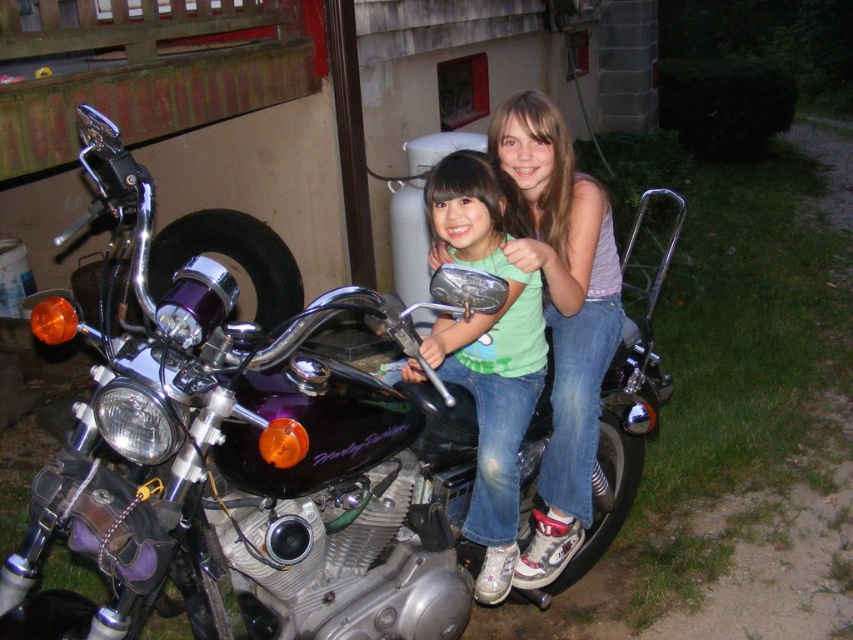
From the picture: Between denim jeans at center and green matte shirt at center, which one is positioned lower?

green matte shirt at center

Between denim jeans at center and green matte shirt at center, which one is positioned higher?

denim jeans at center

Locate an element on the screen. denim jeans at center is located at coordinates (561, 316).

The width and height of the screenshot is (853, 640). Identify the location of denim jeans at center. (561, 316).

Can you confirm if shiny purple motorcycle at center is wider than denim jeans at center?

Correct, the width of shiny purple motorcycle at center exceeds that of denim jeans at center.

Who is more forward, (119, 538) or (520, 189)?

Point (119, 538)

Does point (167, 268) lie in front of point (566, 509)?

No, it is behind (566, 509).

Identify the location of shiny purple motorcycle at center. Image resolution: width=853 pixels, height=640 pixels. (236, 445).

In the scene shown: Is shiny purple motorcycle at center thinner than green matte shirt at center?

No, shiny purple motorcycle at center is not thinner than green matte shirt at center.

Does point (328, 536) lie in front of point (538, 317)?

Yes, it is.

Find the location of `shiny purple motorcycle at center`. shiny purple motorcycle at center is located at coordinates (236, 445).